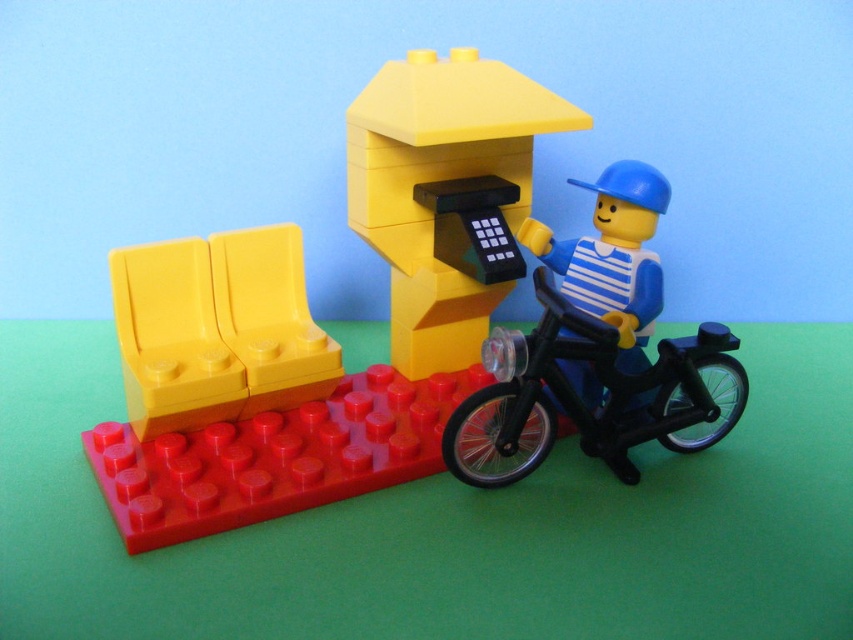
Question: Which of the following is the farthest from the observer?

Choices:
 (A) (474, 61)
 (B) (140, 284)
 (C) (363, 150)

Answer: (A)

Question: From the image, what is the correct spatial relationship of yellow matte bench at left in relation to blue matte construction worker at right?

Choices:
 (A) left
 (B) right

Answer: (A)

Question: Which object is closer to the camera taking this photo?

Choices:
 (A) black plastic monocycle at lower right
 (B) blue matte construction worker at right
 (C) matte black telephone booth at center
 (D) yellow matte bench at left

Answer: (C)

Question: Does yellow matte bench at left appear over black plastic monocycle at lower right?

Choices:
 (A) yes
 (B) no

Answer: (A)

Question: Does yellow matte bench at left have a smaller size compared to blue matte construction worker at right?

Choices:
 (A) yes
 (B) no

Answer: (B)

Question: Which of the following is the farthest from the observer?

Choices:
 (A) black plastic monocycle at lower right
 (B) yellow matte bench at left
 (C) matte black telephone booth at center
 (D) smooth plastic phone booth at center

Answer: (B)